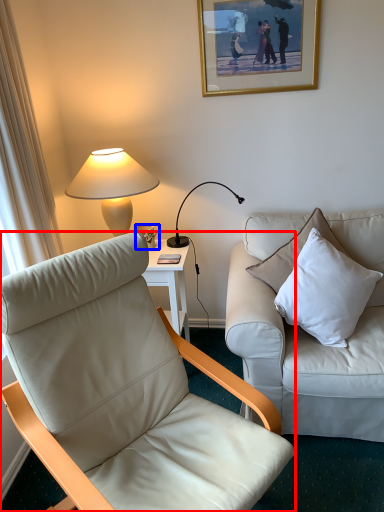
Question: Which of the following is the closest to the observer, chair (highlighted by a red box) or coffee cup (highlighted by a blue box)?

Choices:
 (A) chair
 (B) coffee cup

Answer: (A)